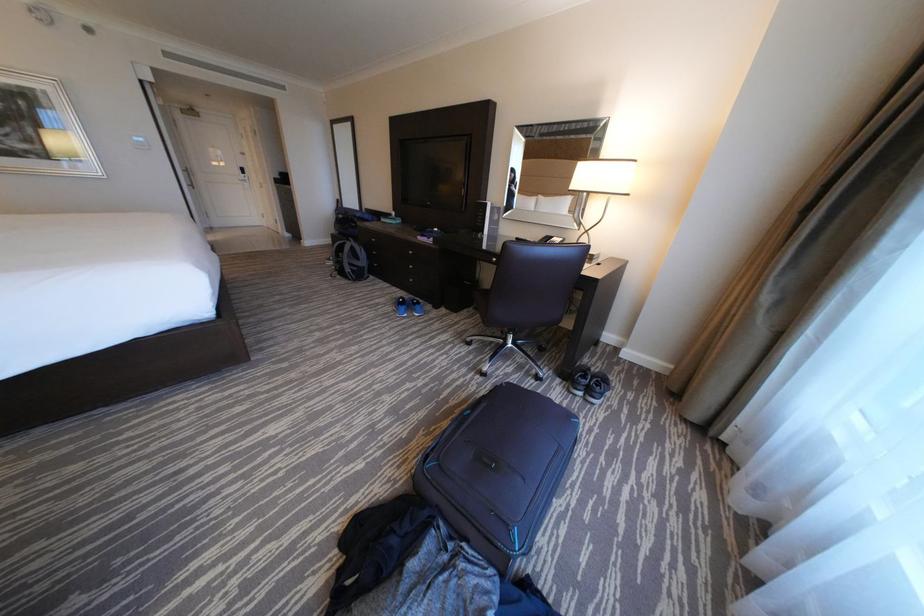
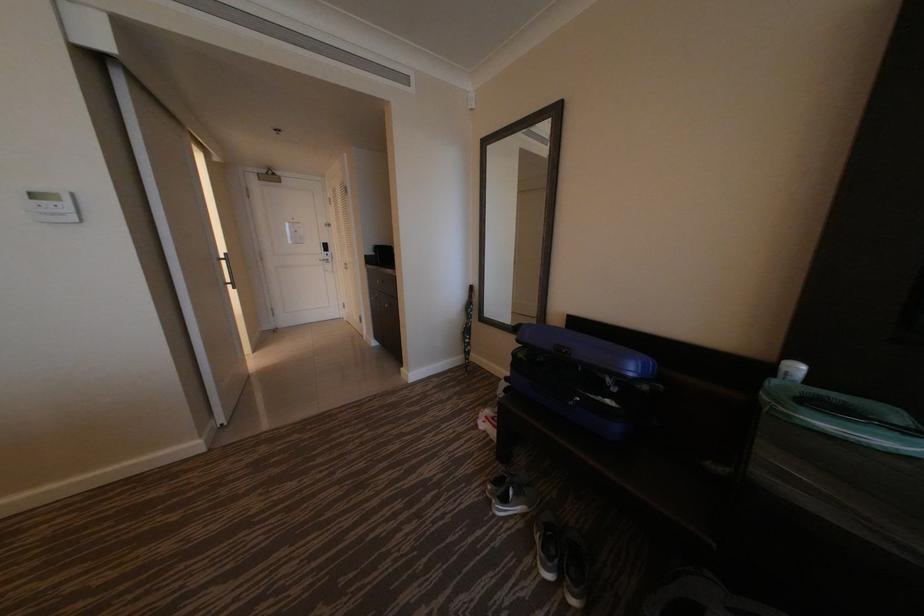
In the scene shown: Which direction would the cameraman need to move to produce the second image?

The movement direction of the cameraman is left, forward.